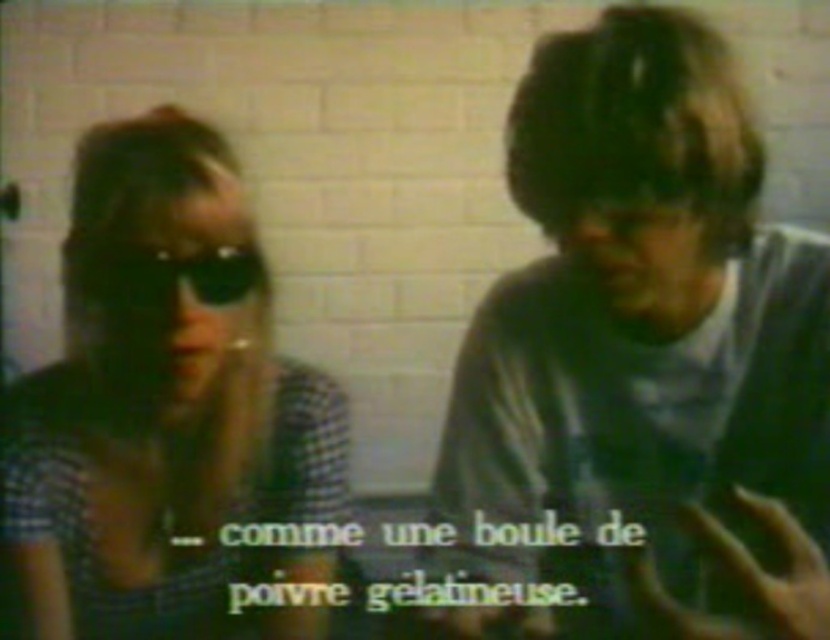
Who is shorter, matte gray shirt at center or black rubber goggles at upper left?

Standing shorter between the two is black rubber goggles at upper left.

Measure the distance between matte gray shirt at center and black rubber goggles at upper left.

The distance of matte gray shirt at center from black rubber goggles at upper left is 14.19 inches.

Between point (565, 253) and point (228, 300), which one is positioned in front?

Point (228, 300) is in front.

Where is `matte gray shirt at center`? matte gray shirt at center is located at coordinates (652, 340).

Can you confirm if matte gray shirt at center is positioned to the right of checkered fabric shirt at left?

Indeed, matte gray shirt at center is positioned on the right side of checkered fabric shirt at left.

Who is more forward, (774, 483) or (47, 381)?

Positioned in front is point (774, 483).

Locate an element on the screen. The image size is (830, 640). matte gray shirt at center is located at coordinates (652, 340).

Who is higher up, checkered fabric shirt at left or black rubber goggles at upper left?

black rubber goggles at upper left is higher up.

Is checkered fabric shirt at left bigger than black rubber goggles at upper left?

Yes, checkered fabric shirt at left is bigger than black rubber goggles at upper left.

Who is more forward, (276, 362) or (233, 248)?

Positioned in front is point (233, 248).

Find the location of `checkered fabric shirt at left`. checkered fabric shirt at left is located at coordinates (167, 406).